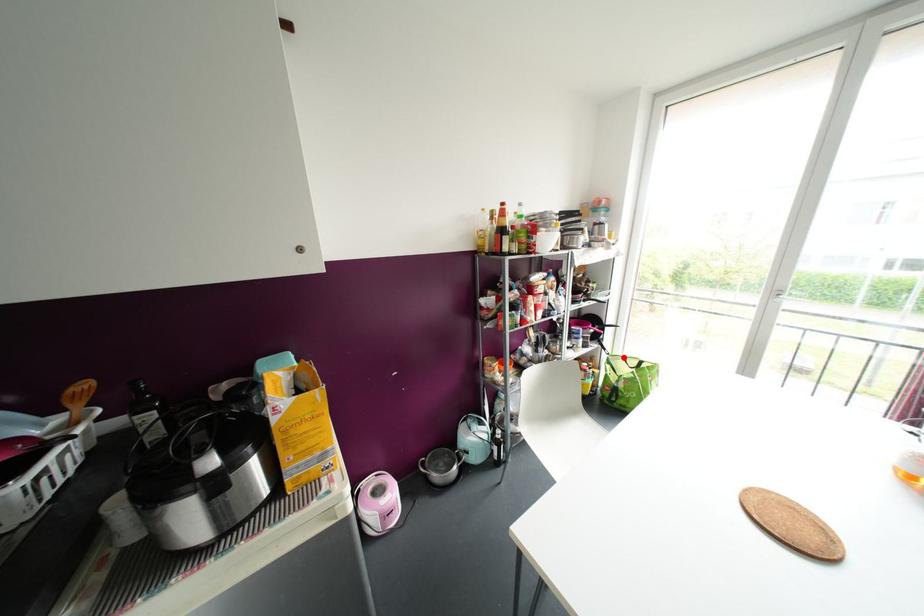
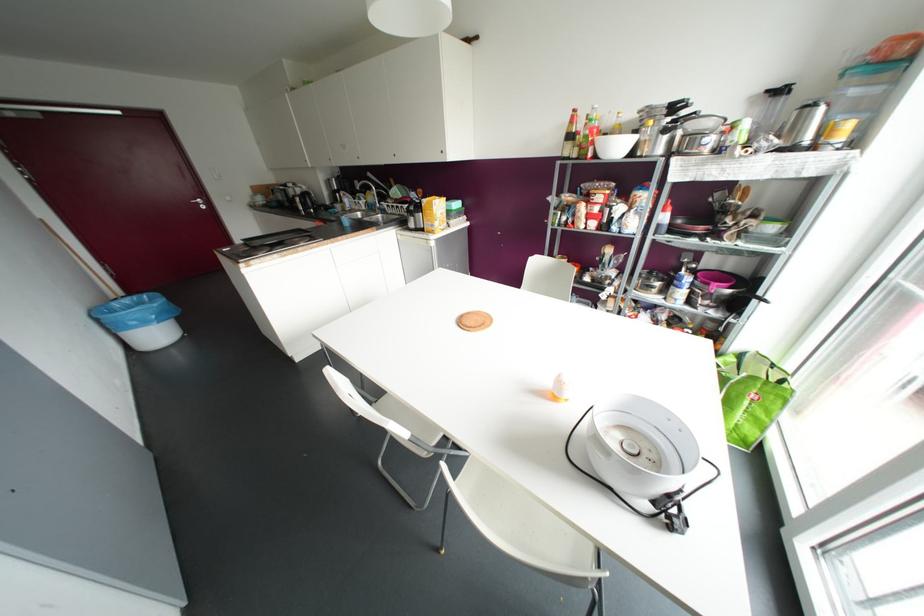
Question: I am providing you with two images of the same scene from different viewpoints. In image1, a red point is highlighted. Considering the same 3D point in image2, which of the following is correct?

Choices:
 (A) It is closer
 (B) It is farther

Answer: (A)